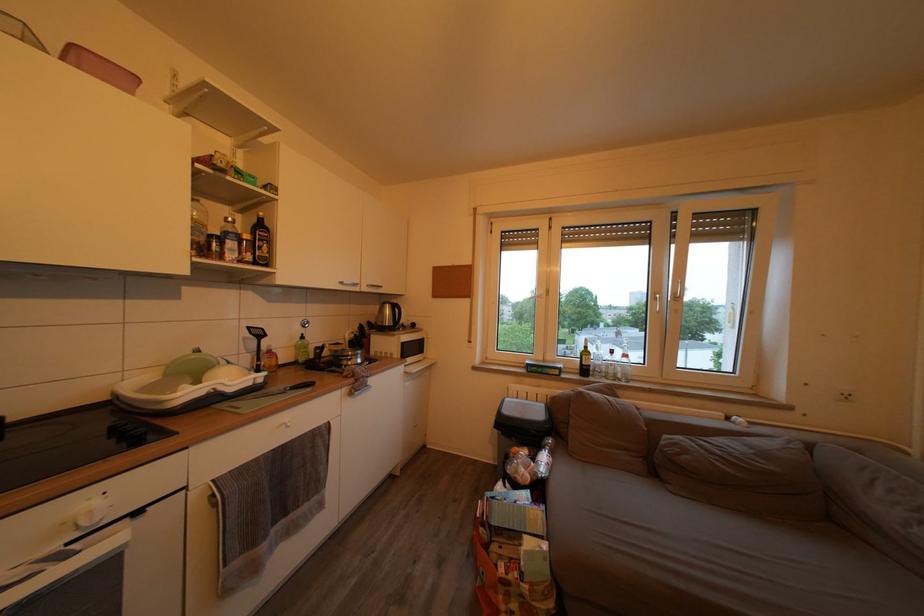
The width and height of the screenshot is (924, 616). What do you see at coordinates (711, 549) in the screenshot?
I see `a brown sofa sitting surface` at bounding box center [711, 549].